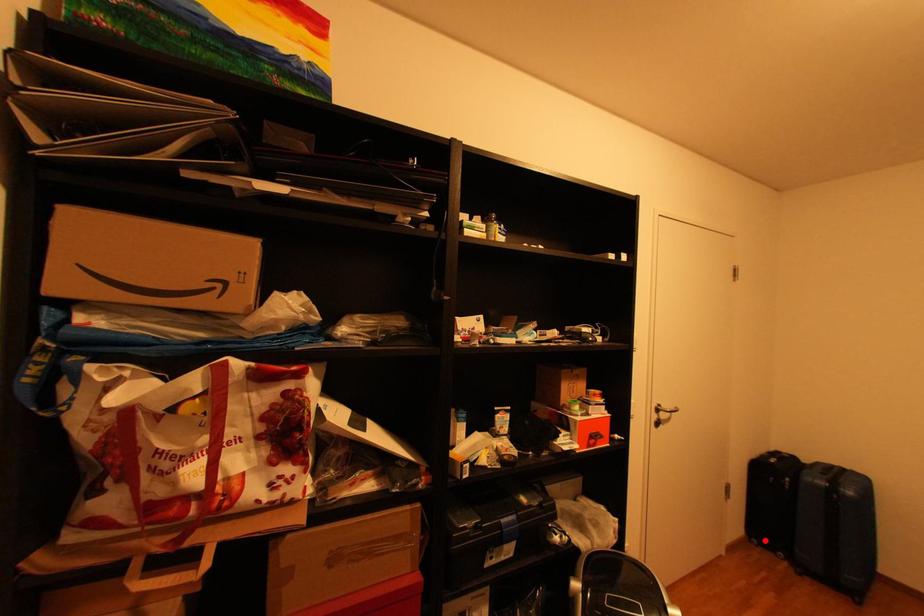
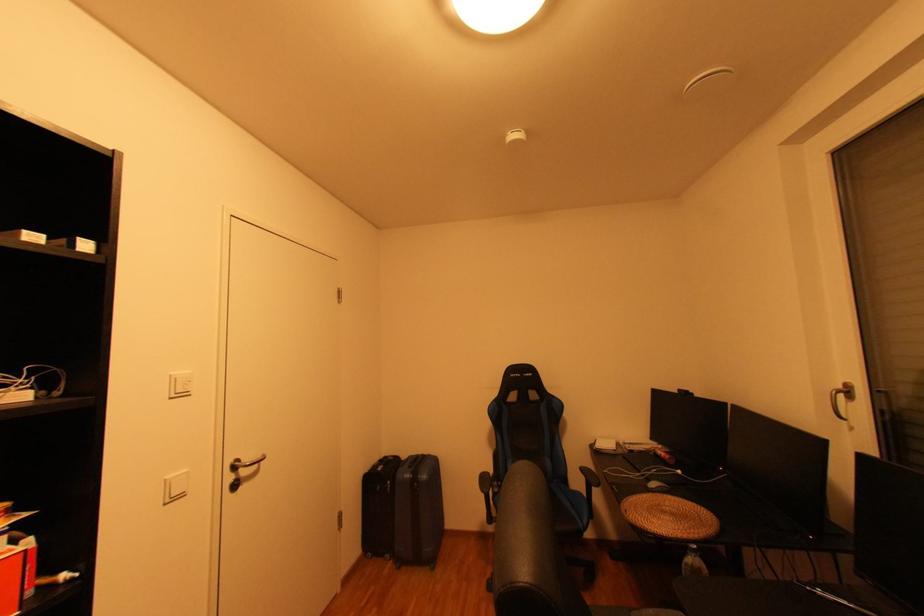
Question: I am providing you with two images of the same scene from different viewpoints. In image1, a red point is highlighted. Considering the same 3D point in image2, which of the following is correct?

Choices:
 (A) It is closer
 (B) It is farther

Answer: (B)